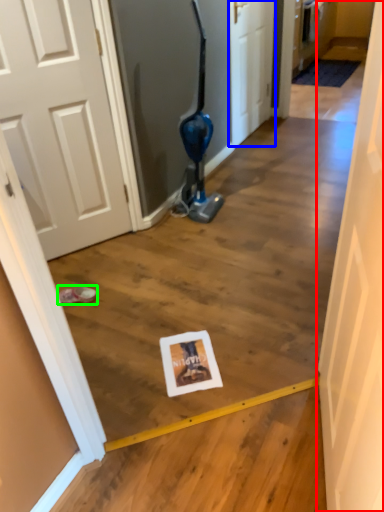
Question: Estimate the real-world distances between objects in this image. Which object is closer to door (highlighted by a red box), door (highlighted by a blue box) or footwear (highlighted by a green box)?

Choices:
 (A) door
 (B) footwear

Answer: (B)